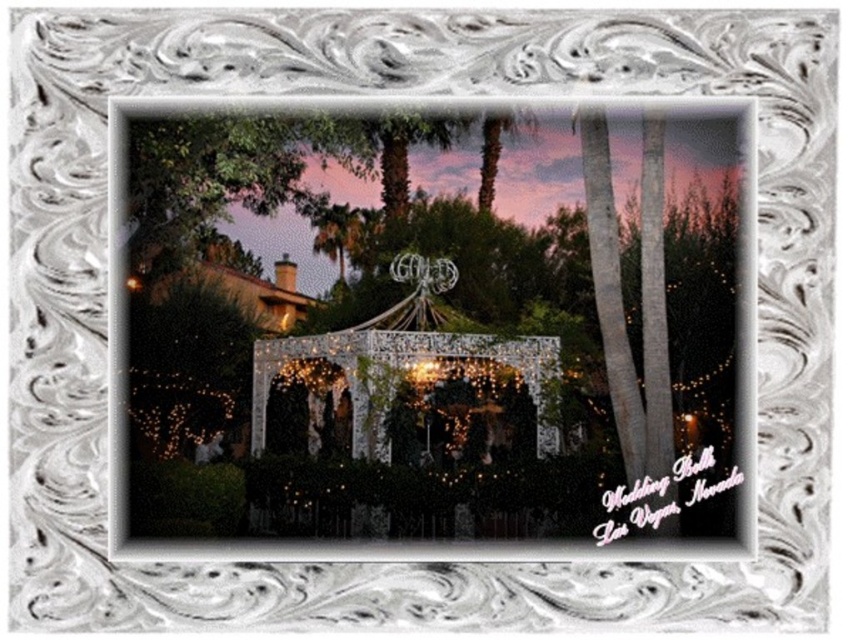
Is white lace gazebo at center smaller than ivory lace gazebo at center?

No.

Who is positioned more to the left, white lace gazebo at center or ivory lace gazebo at center?

ivory lace gazebo at center

Between point (247, 246) and point (451, 339), which one is positioned behind?

Positioned behind is point (247, 246).

At what (x,y) coordinates should I click in order to perform the action: click on white lace gazebo at center. Please return your answer as a coordinate pair (x, y). The height and width of the screenshot is (640, 853). Looking at the image, I should click on (431, 328).